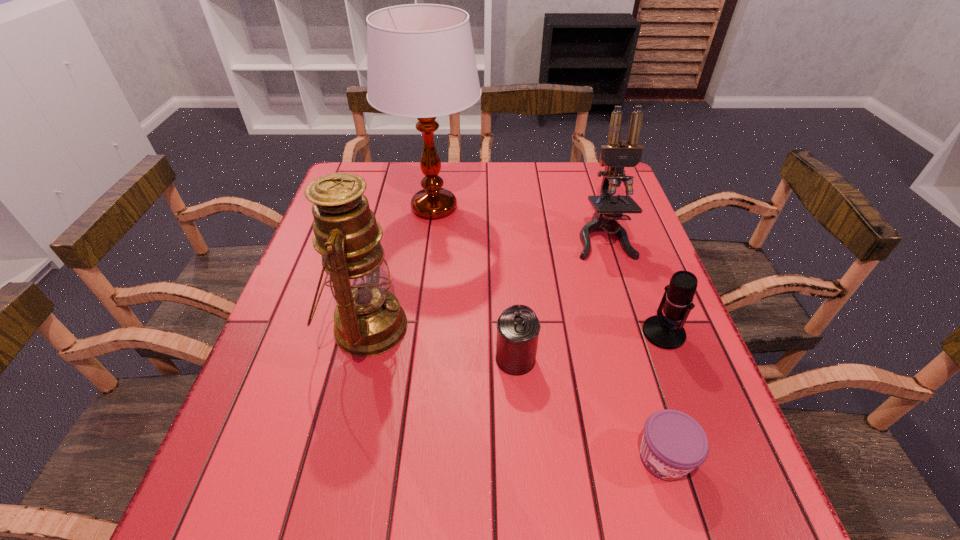
Locate an element on the screen. This screenshot has width=960, height=540. free space that is in between the can and the microscope is located at coordinates (559, 298).

At what (x,y) coordinates should I click in order to perform the action: click on free point between the table lamp and the microscope. Please return your answer as a coordinate pair (x, y). Looking at the image, I should click on click(518, 222).

Where is `vacant area that lies between the oil lamp and the can`? The image size is (960, 540). vacant area that lies between the oil lamp and the can is located at coordinates (442, 343).

Find the location of `free spot between the oil lamp and the third object from left to right`. free spot between the oil lamp and the third object from left to right is located at coordinates (442, 343).

Identify the location of free space between the fourth object from right to left and the microscope. (559, 298).

This screenshot has width=960, height=540. Find the location of `object that can be found as the fourth closest to the microscope`. object that can be found as the fourth closest to the microscope is located at coordinates (369, 320).

Locate which object is the fifth closest to the oil lamp. Please provide its 2D coordinates. Your answer should be formatted as a tuple, i.e. [(x, y)], where the tuple contains the x and y coordinates of a point satisfying the conditions above.

[(665, 332)]

At what (x,y) coordinates should I click in order to perform the action: click on free location that satisfies the following two spatial constraints: 1. at the eyepieces of the microscope; 2. on the right side of the fourth tallest object. Please return your answer as a coordinate pair (x, y). Looking at the image, I should click on (633, 333).

You are a GUI agent. You are given a task and a screenshot of the screen. Output one action in this format:
    pyautogui.click(x=<x>, y=<y>)
    Task: Click on the blank space that satisfies the following two spatial constraints: 1. at the eyepieces of the microscope; 2. on the left side of the fourth tallest object
    
    Given the screenshot: What is the action you would take?
    pyautogui.click(x=633, y=333)

Locate an element on the screen. The width and height of the screenshot is (960, 540). free region that satisfies the following two spatial constraints: 1. at the eyepieces of the microscope; 2. on the left side of the microphone is located at coordinates (633, 333).